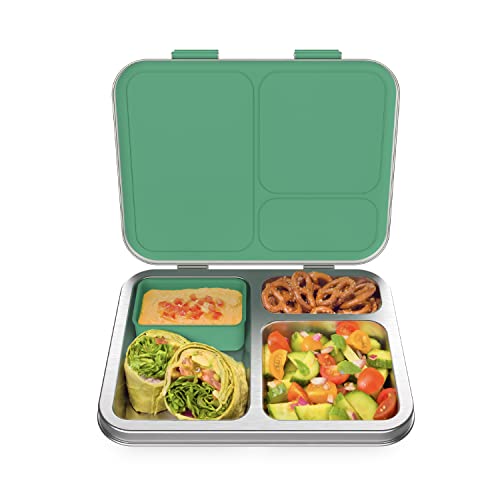
The image size is (500, 500). I want to click on tray, so click(x=229, y=335).